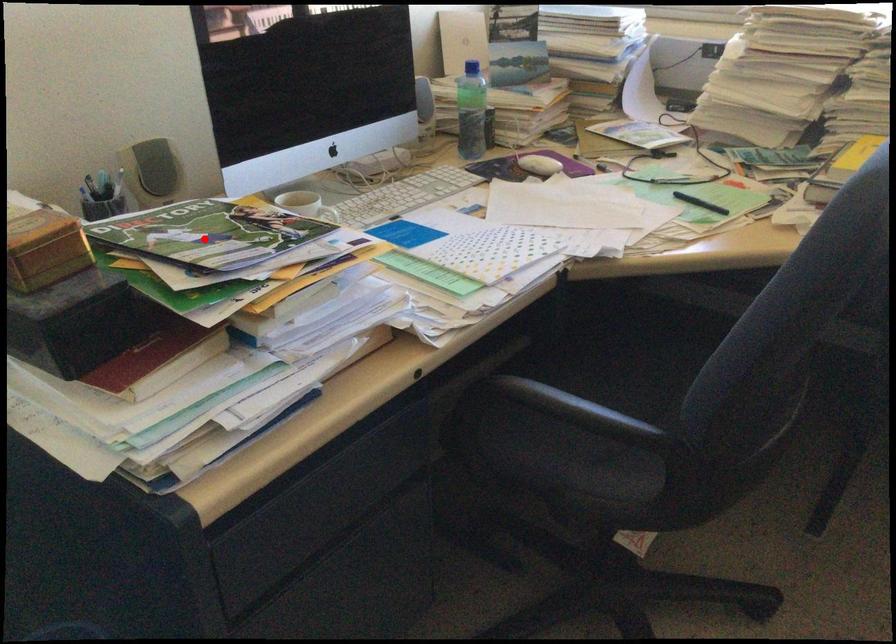
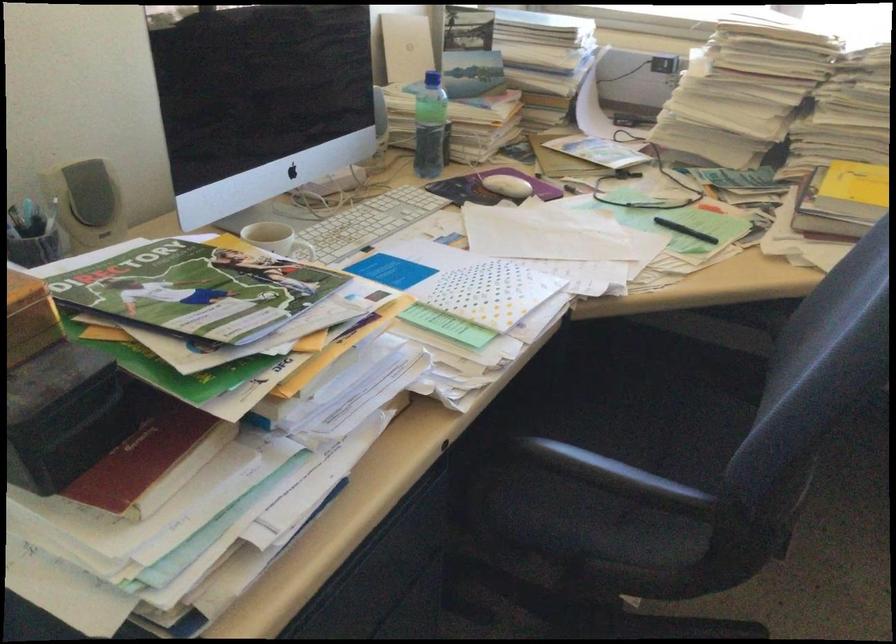
Question: I am providing you with two images of the same scene from different viewpoints. Given a red point in image1, look at the same physical point in image2. Is it:

Choices:
 (A) Closer to the viewpoint
 (B) Farther from the viewpoint

Answer: (A)